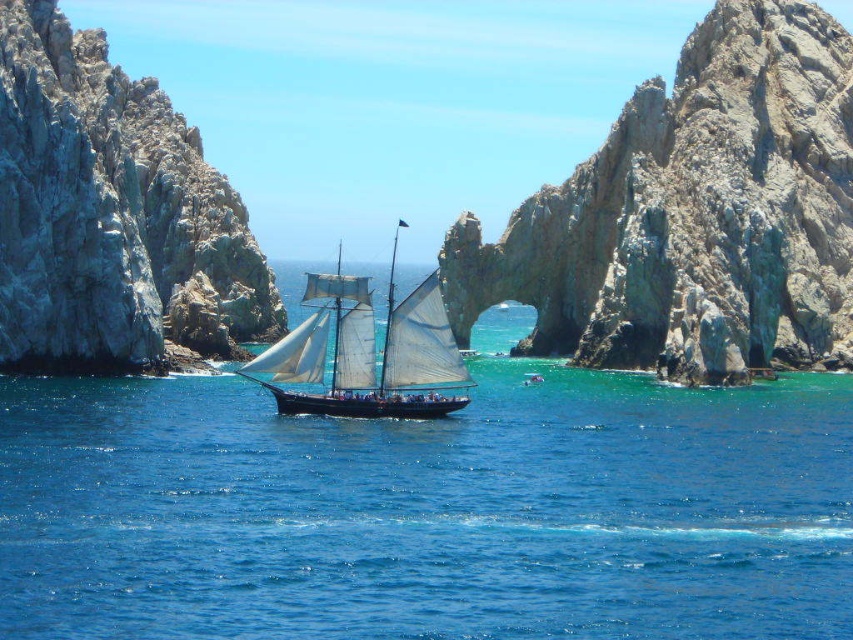
Does point (799, 157) lie behind point (18, 278)?

Yes, point (799, 157) is farther from viewer.

Who is higher up, rugged stone arch at center or white rocky cliff at left?

white rocky cliff at left

Find the location of a particular element. This screenshot has height=640, width=853. rugged stone arch at center is located at coordinates (693, 214).

Where is `rugged stone arch at center`? The image size is (853, 640). rugged stone arch at center is located at coordinates (693, 214).

Is white rocky cliff at left further to the viewer compared to white canvas sailboat at center?

Yes, it is.

Between white rocky cliff at left and white canvas sailboat at center, which one has less height?

white canvas sailboat at center is shorter.

Describe the element at coordinates (111, 212) in the screenshot. I see `white rocky cliff at left` at that location.

I want to click on white rocky cliff at left, so click(x=111, y=212).

Does blue water at center appear on the left side of white rocky cliff at left?

No, blue water at center is not to the left of white rocky cliff at left.

Is blue water at center closer to camera compared to white rocky cliff at left?

Yes, it is in front of white rocky cliff at left.

Is point (848, 470) farther from camera compared to point (71, 184)?

No, it is not.

Locate an element on the screen. blue water at center is located at coordinates (427, 509).